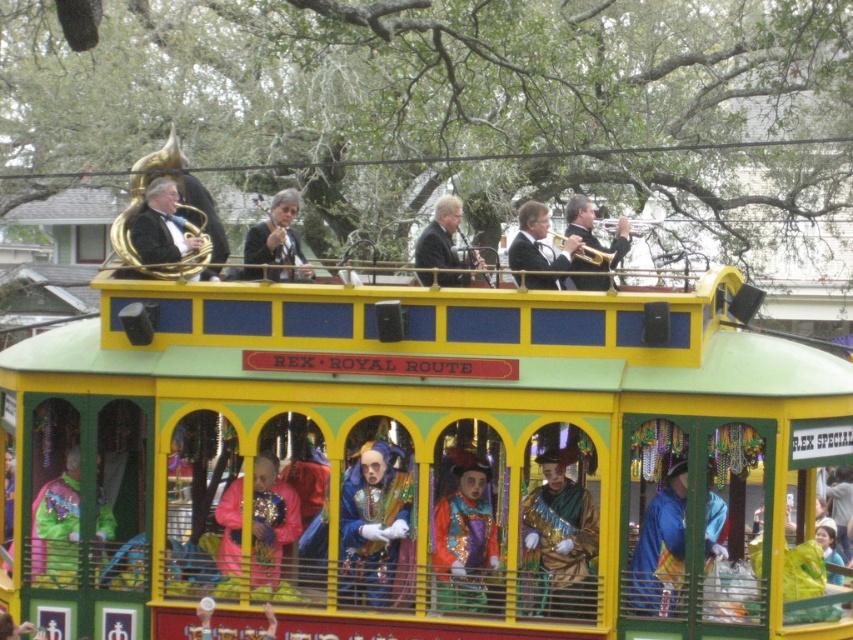
You are a photographer standing at the back of the float. You want to take a photo that includes both the pink velvet mask at center and the matte gold tuba at upper left. Given that your camera has a maximum angle of view of 60 degrees, can you capture both objects in a single frame without moving your position?

The pink velvet mask at center and the matte gold tuba at upper left are 3.30 meters apart from each other. To determine if they can fit within a 60 degree angle, we need to know the distance from the photographer to the float. Without this information, we can only state the distance between the objects, but cannot confirm if the angle of view is sufficient.

You are a photographer at the Mardi Gras parade. You want to take a photo of the pink velvet mask at center and the matte gold tuba at upper left. Which object should you focus on first if you want to capture both in the same frame without moving the camera?

The pink velvet mask at center is taller than the matte gold tuba at upper left, so you should focus on the pink velvet mask at center first to ensure it fits within the frame.